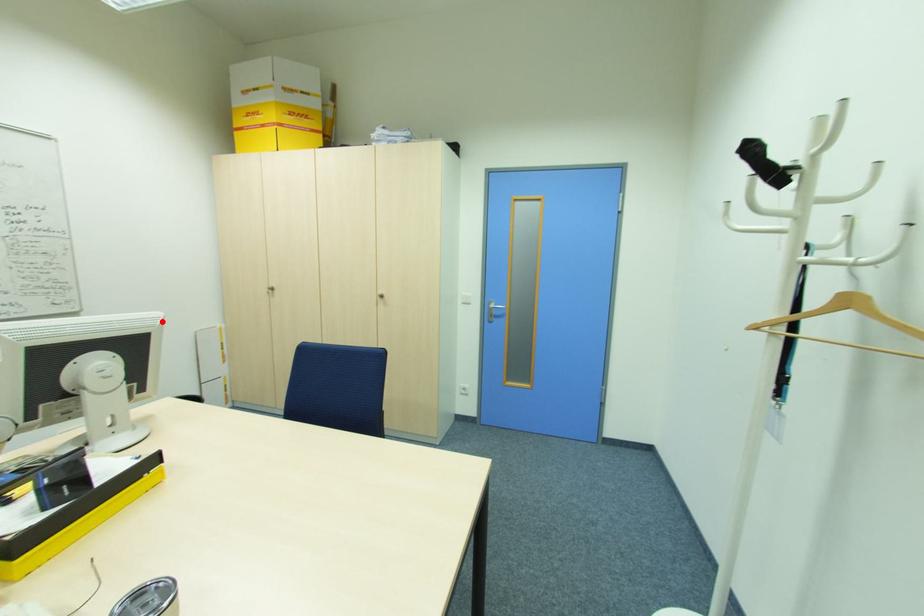
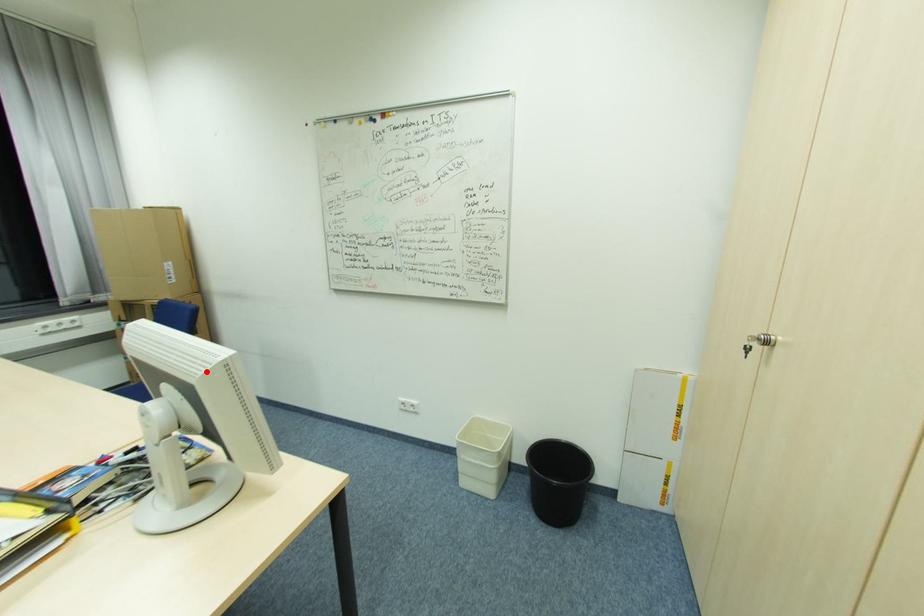
I am providing you with two images of the same scene from different viewpoints. A red point is marked on the first image and another point is marked on the second image. Do the highlighted points in image1 and image2 indicate the same real-world spot?

Yes